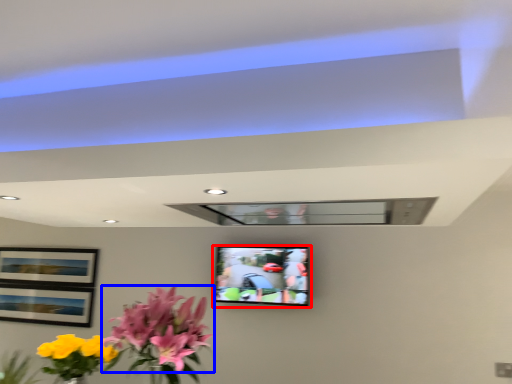
Question: Which object appears closest to the camera in this image, television (highlighted by a red box) or flower (highlighted by a blue box)?

Choices:
 (A) television
 (B) flower

Answer: (B)